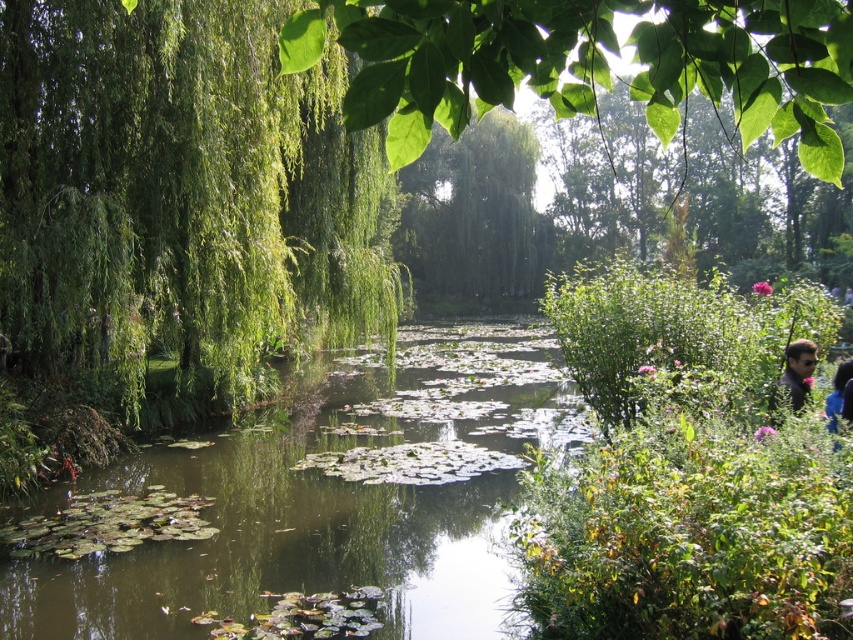
You are standing at the edge of the green leafy river at center and want to cross to the dark gray shirt at lower right. Can you step directly from the riverbank to the shirt without getting your feet wet?

The green leafy river at center might be wider than dark gray shirt at lower right, so it is uncertain if you can step directly from the riverbank to the shirt without getting your feet wet.

You are standing in the scene and want to take a photo of the green leafy willow at left. If you move 0.1 units to the right from your current position, will the willow still be in the frame?

The green leafy willow at left is located at point [181,196]. Moving 0.1 units to the right would shift your position horizontally, but since the willow is at the left side of the image, it should remain within the frame unless the movement causes the camera to pan excessively. However, without knowing the exact field of view or the boundaries of the frame, it is difficult to determine definitively. The question might require more specific information about the camera setup.